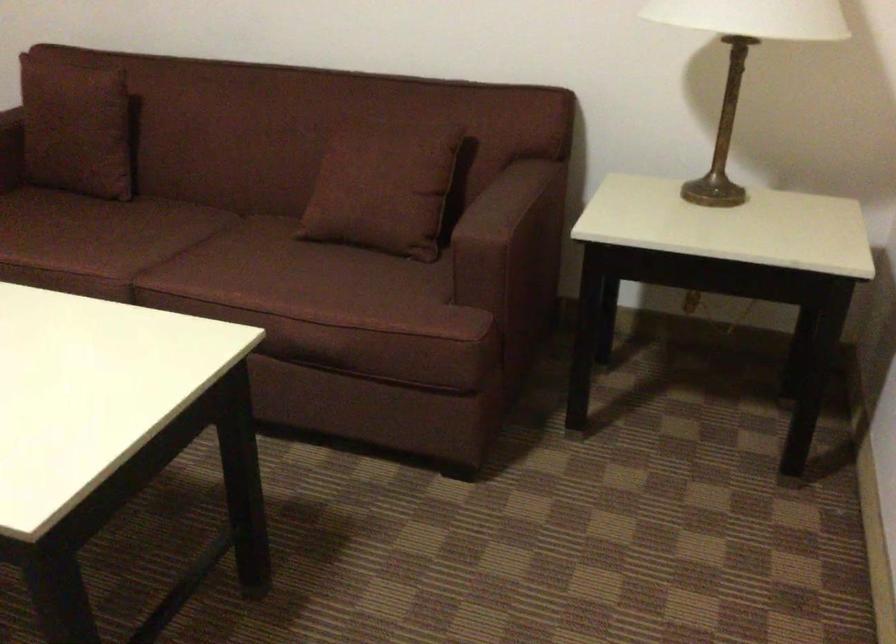
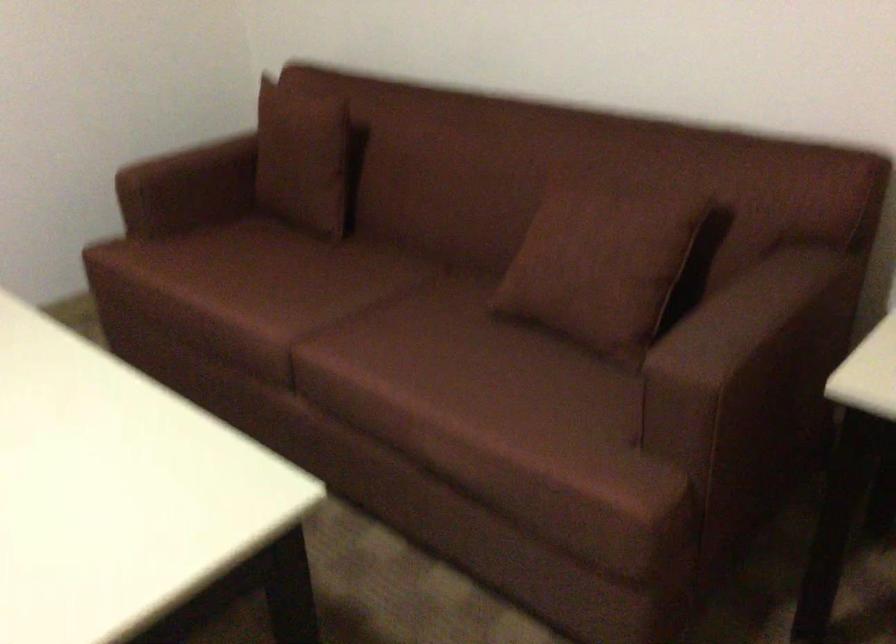
What movement of the cameraman would produce the second image?

The cameraman walked toward right, forward.